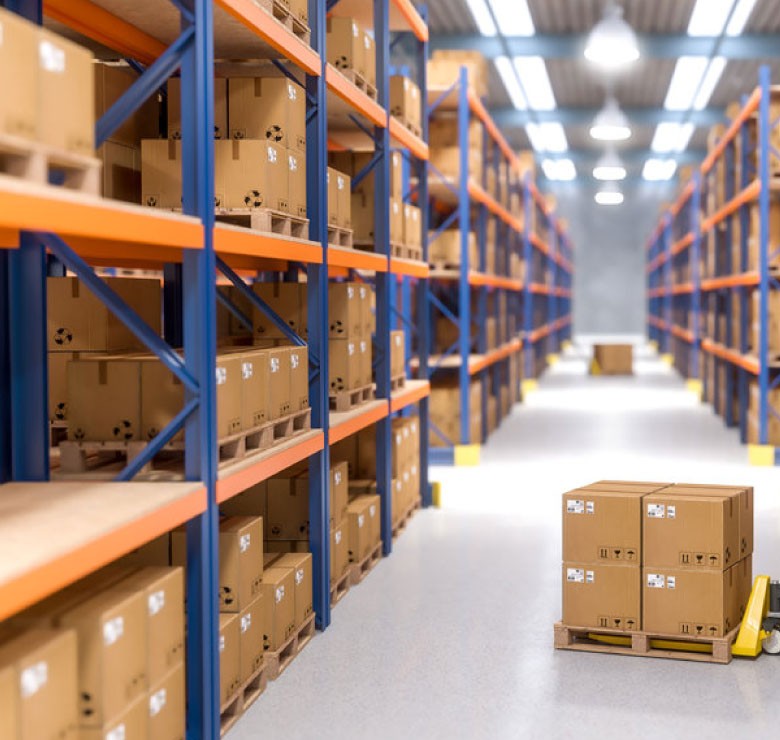
You are a GUI agent. You are given a task and a screenshot of the screen. Output one action in this format:
    pyautogui.click(x=<x>, y=<y>)
    Task: Click on the lighting
    
    Given the screenshot: What is the action you would take?
    pyautogui.click(x=612, y=49), pyautogui.click(x=601, y=131), pyautogui.click(x=607, y=172), pyautogui.click(x=608, y=201)